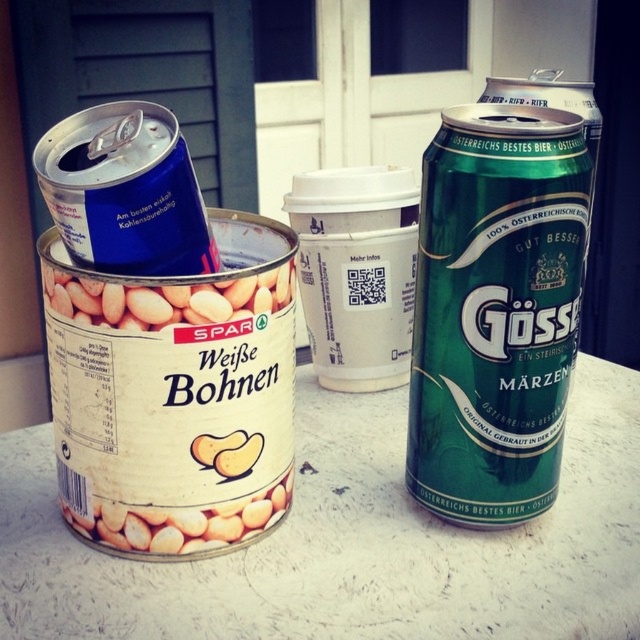
Who is more forward, [172,198] or [92,320]?

Point [92,320]

Between point (182, 244) and point (104, 314), which one is positioned behind?

The point (182, 244) is behind.

The height and width of the screenshot is (640, 640). Identify the location of blue metallic can at upper left. (125, 192).

I want to click on blue metallic can at upper left, so click(x=125, y=192).

How far apart are green metallic beer can at right and blue metallic can at upper left?

green metallic beer can at right and blue metallic can at upper left are 8.99 inches apart.

Who is shorter, green metallic beer can at right or blue metallic can at upper left?

With less height is blue metallic can at upper left.

Between point (502, 228) and point (124, 147), which one is positioned in front?

Point (502, 228)

The image size is (640, 640). Identify the location of green metallic beer can at right. (497, 308).

Can you confirm if green metallic beer can at right is positioned below white matte beans can at center?

Yes.

Consider the image. Does green metallic beer can at right have a larger size compared to white matte beans can at center?

Indeed, green metallic beer can at right has a larger size compared to white matte beans can at center.

Measure the distance between point (428,355) and camera.

They are 22.07 inches apart.

Where is `green metallic beer can at right`? This screenshot has width=640, height=640. green metallic beer can at right is located at coordinates (497, 308).